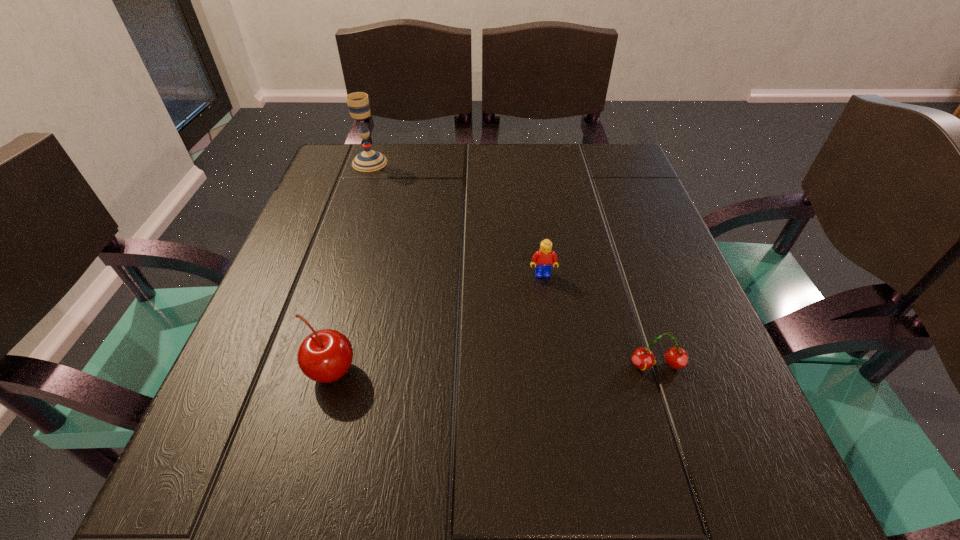
In the image, there is a desktop. Find the location of `free space at the right edge`. free space at the right edge is located at coordinates (677, 402).

In the image, there is a desktop. Where is `blank space at the far left corner`? This screenshot has width=960, height=540. blank space at the far left corner is located at coordinates (348, 159).

Locate an element on the screen. This screenshot has height=540, width=960. vacant region at the near left corner of the desktop is located at coordinates (244, 453).

This screenshot has height=540, width=960. Find the location of `vacant space at the far right corner of the desktop`. vacant space at the far right corner of the desktop is located at coordinates (584, 166).

You are a GUI agent. You are given a task and a screenshot of the screen. Output one action in this format:
    pyautogui.click(x=<x>, y=<y>)
    Task: Click on the free space between the taller cherry and the second object from right to left
    The height and width of the screenshot is (540, 960).
    Given the screenshot: What is the action you would take?
    pyautogui.click(x=437, y=323)

Identify the location of empty space that is in between the rightmost object and the farthest object. (514, 264).

The image size is (960, 540). In order to click on vacant region between the farthest object and the Lego in this screenshot , I will do point(456,219).

Locate an element on the screen. The image size is (960, 540). vacant area between the left cherry and the second object from right to left is located at coordinates (437, 323).

Image resolution: width=960 pixels, height=540 pixels. What are the coordinates of `free area in between the farthest object and the third nearest object` in the screenshot? It's located at (456, 219).

Find the location of a particular element. free space between the tallest object and the right cherry is located at coordinates (514, 264).